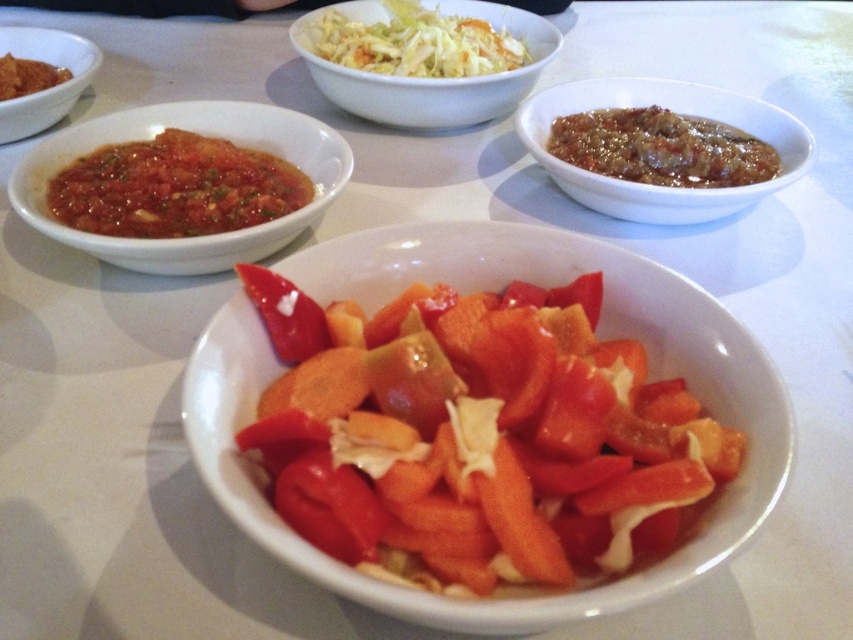
Question: Among these points, which one is nearest to the camera?

Choices:
 (A) (724, 179)
 (B) (450, 244)
 (C) (314, 122)

Answer: (B)

Question: Is slightly glossy brown sauce at upper right below white glossy bowl at upper center?

Choices:
 (A) yes
 (B) no

Answer: (A)

Question: Considering the real-world distances, which object is farthest from the matte red sauce at upper left?

Choices:
 (A) tomato-based sauce at upper left
 (B) savory brown sauce at upper right
 (C) white glossy bowl at upper center

Answer: (B)

Question: Does slightly glossy ceramic bowl at center have a greater width compared to savory brown sauce at upper right?

Choices:
 (A) yes
 (B) no

Answer: (A)

Question: Estimate the real-world distances between objects in this image. Which object is closer to the matte brown sauce at upper left?

Choices:
 (A) tomato-based sauce at upper left
 (B) slightly glossy ceramic bowl at center
 (C) savory brown sauce at upper right

Answer: (A)

Question: Does slightly glossy tomato sauce at upper left appear over matte brown sauce at upper left?

Choices:
 (A) yes
 (B) no

Answer: (B)